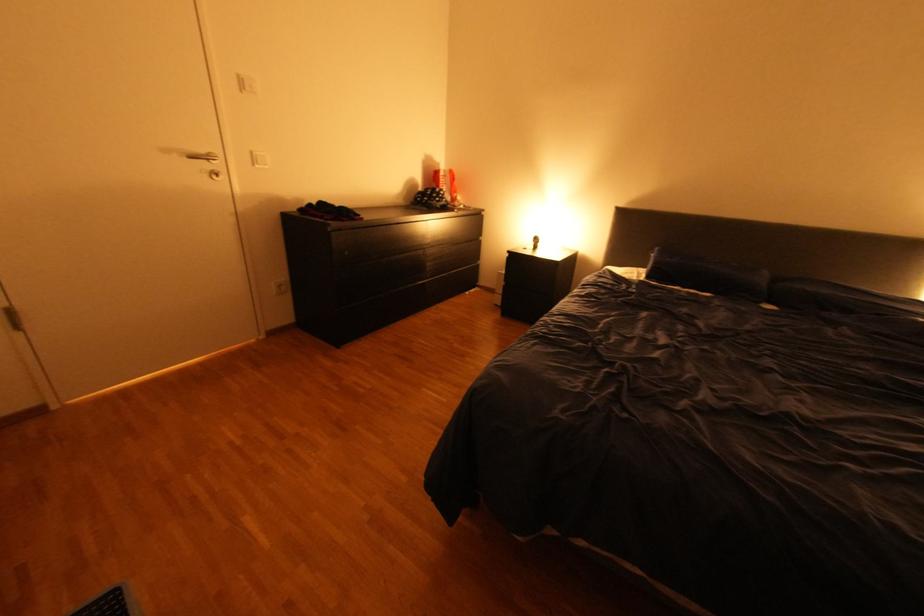
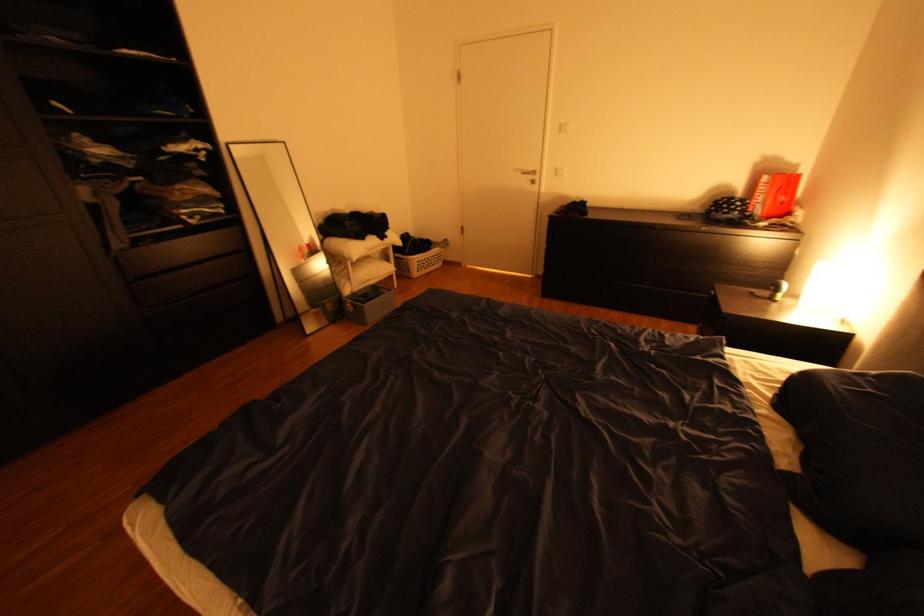
Where in the second image is the point corresponding to the point at 454,196 from the first image?

(748, 208)